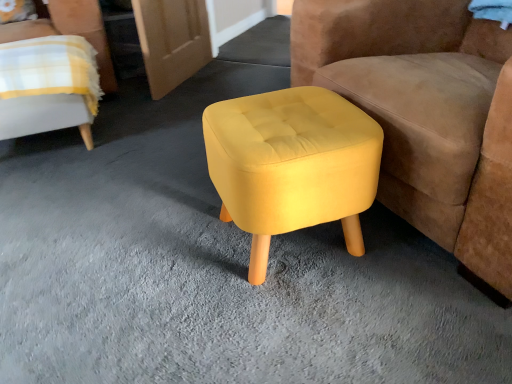
Question: Which direction should I rotate to look at yellow fabric ottoman at center, arranged as the first chair when viewed from the right, — up or down?

Choices:
 (A) down
 (B) up

Answer: (B)

Question: Is yellow fabric stool at center beside yellow fabric chair at upper left, marked as the second chair in a right-to-left arrangement?

Choices:
 (A) no
 (B) yes

Answer: (A)

Question: Is yellow fabric stool at center wider than yellow fabric chair at upper left, which is counted as the 1th chair, starting from the left?

Choices:
 (A) yes
 (B) no

Answer: (B)

Question: Does yellow fabric stool at center have a smaller size compared to yellow fabric chair at upper left, marked as the second chair in a right-to-left arrangement?

Choices:
 (A) no
 (B) yes

Answer: (A)

Question: Does yellow fabric stool at center turn towards yellow fabric chair at upper left, marked as the second chair in a right-to-left arrangement?

Choices:
 (A) no
 (B) yes

Answer: (A)

Question: Does yellow fabric stool at center appear on the right side of yellow fabric chair at upper left, marked as the second chair in a right-to-left arrangement?

Choices:
 (A) no
 (B) yes

Answer: (B)

Question: Does yellow fabric stool at center come behind yellow fabric chair at upper left, marked as the second chair in a right-to-left arrangement?

Choices:
 (A) no
 (B) yes

Answer: (A)

Question: From the image's perspective, is yellow fabric chair at upper left, marked as the second chair in a right-to-left arrangement, under yellow fabric ottoman at center, arranged as the first chair when viewed from the right?

Choices:
 (A) no
 (B) yes

Answer: (A)

Question: Is yellow fabric chair at upper left, which is counted as the 1th chair, starting from the left, to the right of yellow fabric ottoman at center, arranged as the first chair when viewed from the right, from the viewer's perspective?

Choices:
 (A) yes
 (B) no

Answer: (B)

Question: Does yellow fabric chair at upper left, which is counted as the 1th chair, starting from the left, have a smaller size compared to yellow fabric ottoman at center, arranged as the second chair when viewed from the left?

Choices:
 (A) yes
 (B) no

Answer: (A)

Question: Would you say yellow fabric chair at upper left, marked as the second chair in a right-to-left arrangement, contains yellow fabric ottoman at center, arranged as the first chair when viewed from the right?

Choices:
 (A) no
 (B) yes

Answer: (A)

Question: From the image's perspective, is yellow fabric chair at upper left, which is counted as the 1th chair, starting from the left, on yellow fabric ottoman at center, arranged as the second chair when viewed from the left?

Choices:
 (A) yes
 (B) no

Answer: (A)

Question: Considering the relative sizes of yellow fabric chair at upper left, marked as the second chair in a right-to-left arrangement, and yellow fabric ottoman at center, arranged as the second chair when viewed from the left, in the image provided, is yellow fabric chair at upper left, marked as the second chair in a right-to-left arrangement, thinner than yellow fabric ottoman at center, arranged as the second chair when viewed from the left,?

Choices:
 (A) yes
 (B) no

Answer: (A)

Question: Can you confirm if yellow fabric chair at upper left, which is counted as the 1th chair, starting from the left, is smaller than yellow fabric stool at center?

Choices:
 (A) no
 (B) yes

Answer: (B)